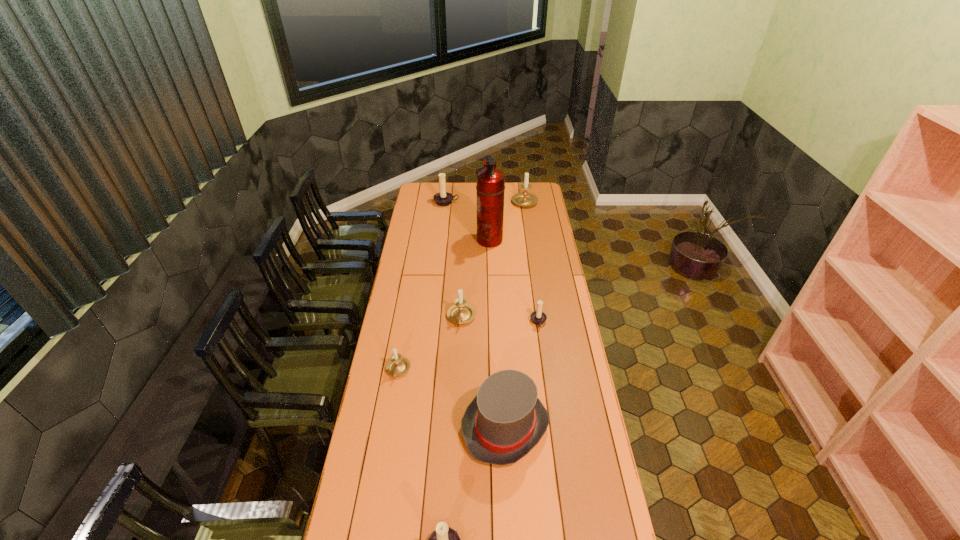
Identify which brown candle holder is the nearest to the gray dress hat. Please provide its 2D coordinates. Your answer should be formatted as a tuple, i.e. [(x, y)], where the tuple contains the x and y coordinates of a point satisfying the conditions above.

[(444, 539)]

The width and height of the screenshot is (960, 540). I want to click on brown candle holder that stands as the second closest to the second smallest beige candle holder, so click(444, 539).

You are a GUI agent. You are given a task and a screenshot of the screen. Output one action in this format:
    pyautogui.click(x=<x>, y=<y>)
    Task: Click on the free space that satisfies the following two spatial constraints: 1. on the side of the red fire extinguisher with the handle and hose; 2. with a handle on the side of the second nearest beige candle holder
    This screenshot has height=540, width=960.
    Given the screenshot: What is the action you would take?
    pyautogui.click(x=492, y=318)

Image resolution: width=960 pixels, height=540 pixels. Identify the location of vacant area in the image that satisfies the following two spatial constraints: 1. on the wick of the dress hat; 2. on the right side of the biggest brown candle holder. (422, 427).

Where is `vacant space that satisfies the following two spatial constraints: 1. on the side of the sixth nearest object with the handle and hose; 2. with a handle on the side of the second smallest beige candle holder`? This screenshot has height=540, width=960. vacant space that satisfies the following two spatial constraints: 1. on the side of the sixth nearest object with the handle and hose; 2. with a handle on the side of the second smallest beige candle holder is located at coordinates (492, 318).